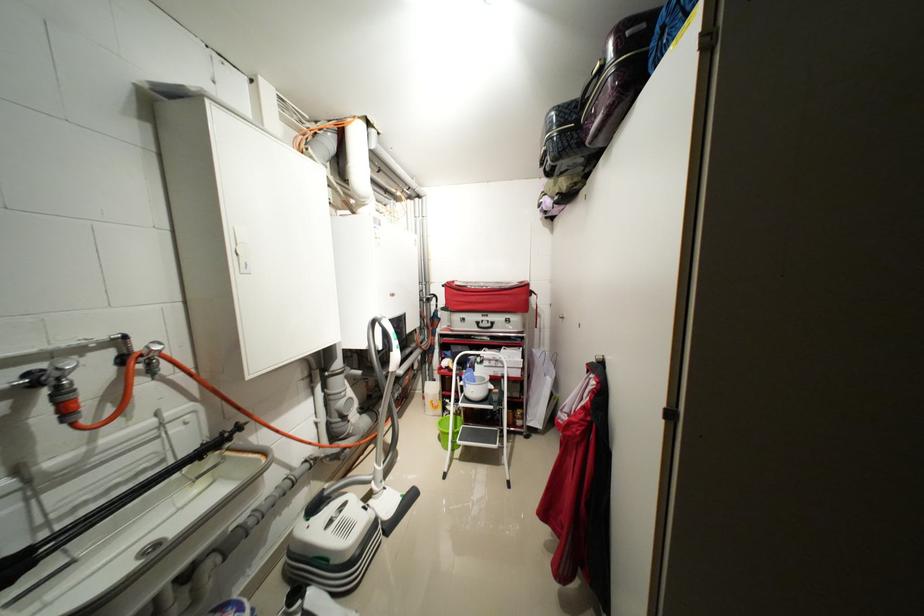
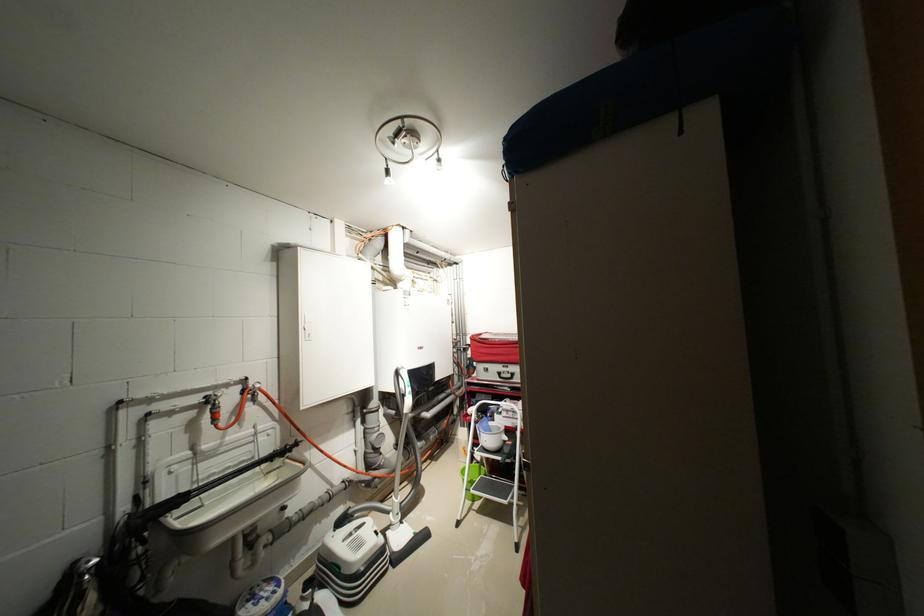
Where in the second image is the point corresponding to pixel 464 376 from the first image?

(482, 424)